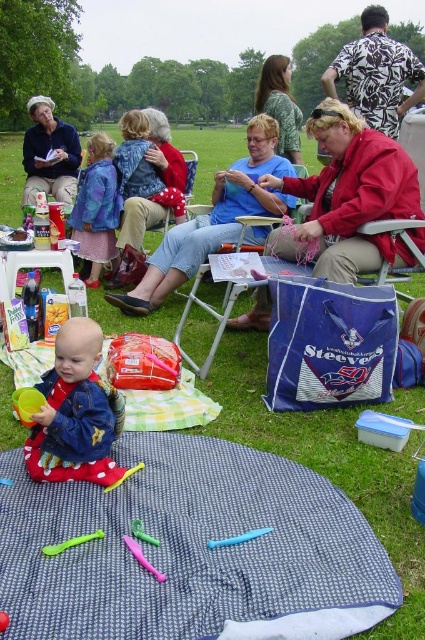
How much distance is there between blue plastic toy at lower center and pink plastic crayon at lower center?

The distance of blue plastic toy at lower center from pink plastic crayon at lower center is 8.51 inches.

Does blue plastic toy at lower center have a lesser width compared to pink plastic crayon at lower center?

Incorrect, blue plastic toy at lower center's width is not less than pink plastic crayon at lower center's.

Is point (257, 532) behind point (149, 563)?

Yes, it is behind point (149, 563).

I want to click on blue plastic toy at lower center, so click(x=238, y=538).

What do you see at coordinates (141, 557) in the screenshot? I see `pink plastic crayon at lower center` at bounding box center [141, 557].

Can you confirm if pink plastic crayon at lower center is positioned to the left of pink rubber toy at center?

In fact, pink plastic crayon at lower center is to the right of pink rubber toy at center.

Identify the location of pink plastic crayon at lower center. (141, 557).

Is red denim jacket at center positioned in front of denim jacket at center?

Yes, red denim jacket at center is closer to the viewer.

Image resolution: width=425 pixels, height=640 pixels. What are the coordinates of `red denim jacket at center` in the screenshot? It's located at (76, 413).

Describe the element at coordinates (76, 413) in the screenshot. The width and height of the screenshot is (425, 640). I see `red denim jacket at center` at that location.

Locate an element on the screen. The width and height of the screenshot is (425, 640). red denim jacket at center is located at coordinates (76, 413).